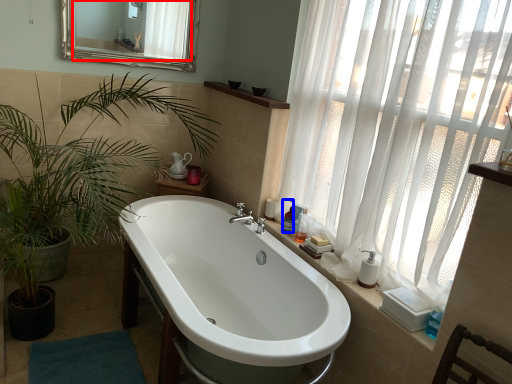
Question: Which of the following is the farthest to the observer, mirror (highlighted by a red box) or toiletry (highlighted by a blue box)?

Choices:
 (A) mirror
 (B) toiletry

Answer: (A)